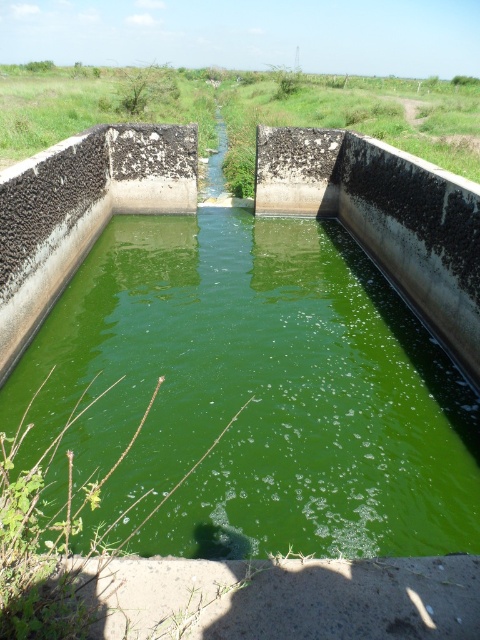
Can you confirm if green algae water at center is taller than gray concrete at bottom?

Yes, green algae water at center is taller than gray concrete at bottom.

Who is shorter, green algae water at center or gray concrete at bottom?

Standing shorter between the two is gray concrete at bottom.

The width and height of the screenshot is (480, 640). What are the coordinates of `green algae water at center` in the screenshot? It's located at (253, 394).